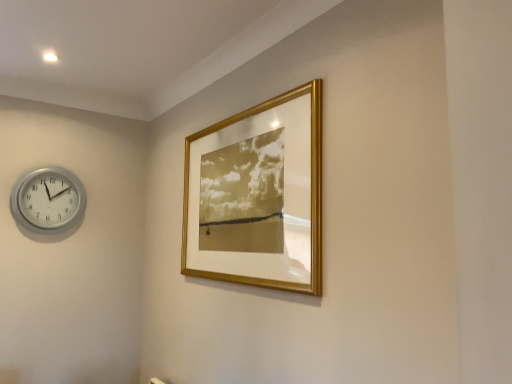
Question: Is silver metallic wall clock at left behind gold metallic picture frame at upper center?

Choices:
 (A) yes
 (B) no

Answer: (A)

Question: From the image's perspective, is silver metallic wall clock at left located beneath gold metallic picture frame at upper center?

Choices:
 (A) yes
 (B) no

Answer: (A)

Question: Considering the relative sizes of silver metallic wall clock at left and gold metallic picture frame at upper center in the image provided, is silver metallic wall clock at left taller than gold metallic picture frame at upper center?

Choices:
 (A) no
 (B) yes

Answer: (A)

Question: From a real-world perspective, is silver metallic wall clock at left located higher than gold metallic picture frame at upper center?

Choices:
 (A) no
 (B) yes

Answer: (B)

Question: Is silver metallic wall clock at left with gold metallic picture frame at upper center?

Choices:
 (A) yes
 (B) no

Answer: (B)

Question: Is silver metallic wall clock at left positioned before gold metallic picture frame at upper center?

Choices:
 (A) no
 (B) yes

Answer: (A)

Question: Is gold metallic picture frame at upper center oriented away from silver metallic wall clock at left?

Choices:
 (A) yes
 (B) no

Answer: (B)

Question: Is gold metallic picture frame at upper center facing towards silver metallic wall clock at left?

Choices:
 (A) no
 (B) yes

Answer: (A)

Question: Is gold metallic picture frame at upper center closer to the viewer compared to silver metallic wall clock at left?

Choices:
 (A) no
 (B) yes

Answer: (B)

Question: From the image's perspective, is gold metallic picture frame at upper center below silver metallic wall clock at left?

Choices:
 (A) yes
 (B) no

Answer: (B)

Question: Would you say silver metallic wall clock at left is part of gold metallic picture frame at upper center's contents?

Choices:
 (A) no
 (B) yes

Answer: (A)

Question: Is gold metallic picture frame at upper center wider than silver metallic wall clock at left?

Choices:
 (A) no
 (B) yes

Answer: (A)

Question: From a real-world perspective, is gold metallic picture frame at upper center positioned above or below silver metallic wall clock at left?

Choices:
 (A) below
 (B) above

Answer: (A)